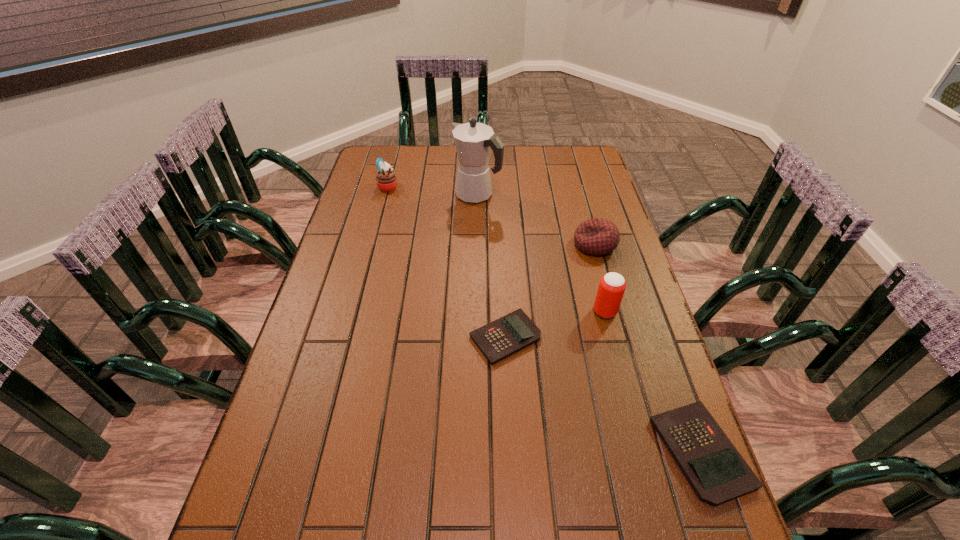
The calculators are evenly distributed in the image. To maintain this, where would you place another calculator on the left? Please point to a free space. Please provide its 2D coordinates. Your answer should be formatted as a tuple, i.e. [(x, y)], where the tuple contains the x and y coordinates of a point satisfying the conditions above.

[(371, 259)]